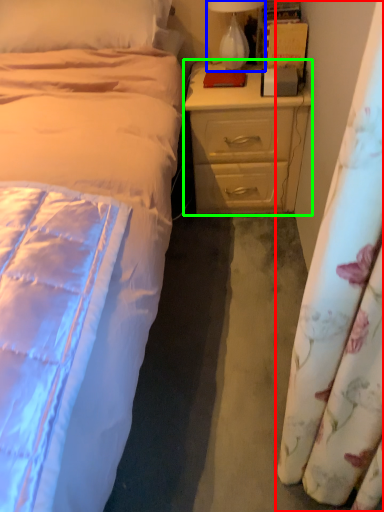
Question: Which is nearer to the curtain (highlighted by a red box)? lamp (highlighted by a blue box) or nightstand (highlighted by a green box).

Choices:
 (A) lamp
 (B) nightstand

Answer: (B)